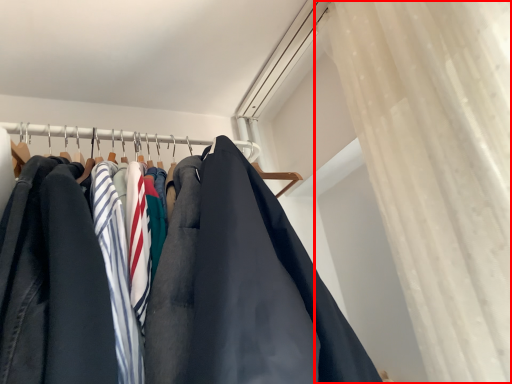
Question: From the image's perspective, considering the relative positions of curtain (annotated by the red box) and closet in the image provided, where is curtain (annotated by the red box) located with respect to the staircase?

Choices:
 (A) above
 (B) below

Answer: (A)